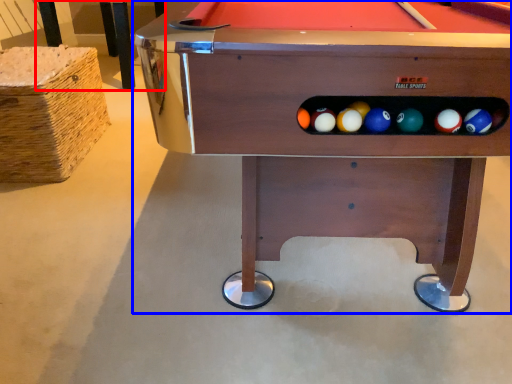
Question: Which point is further to the camera, table (highlighted by a red box) or billiard table (highlighted by a blue box)?

Choices:
 (A) table
 (B) billiard table

Answer: (A)